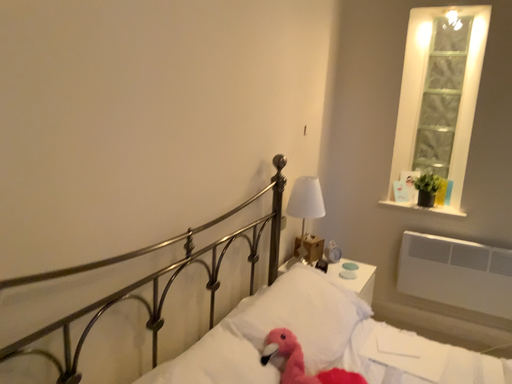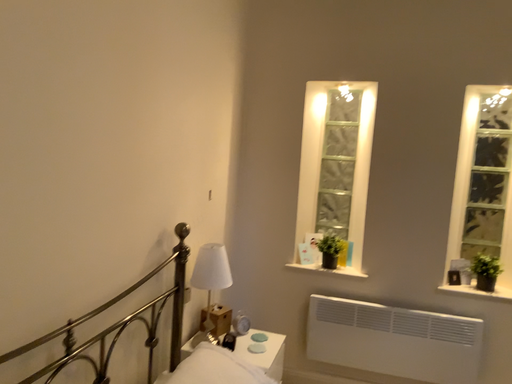
Question: Which way did the camera rotate in the video?

Choices:
 (A) rotated left
 (B) rotated right

Answer: (B)